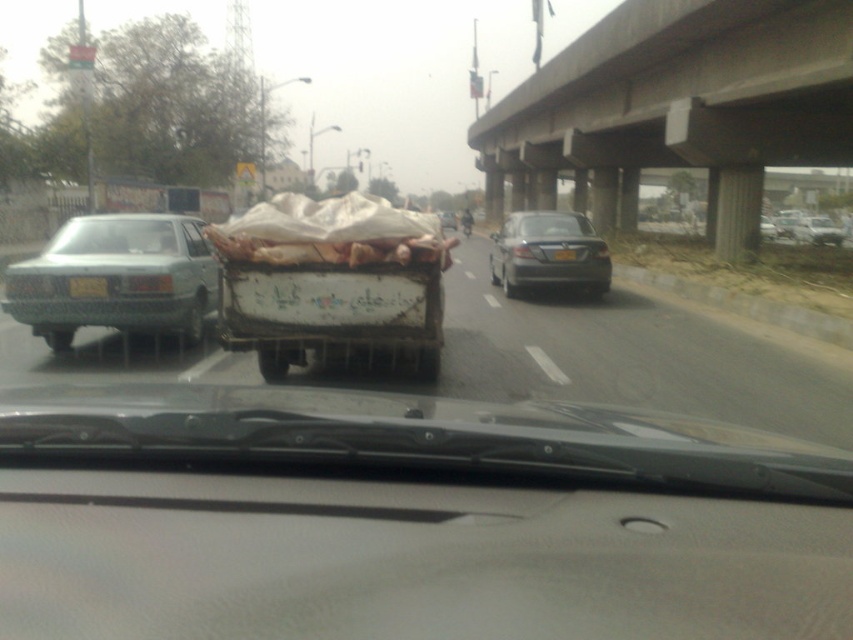
How distant is concrete at upper center from transparent glass windshield at left?

The distance of concrete at upper center from transparent glass windshield at left is 21.44 meters.

Can you confirm if concrete at upper center is positioned to the right of transparent glass windshield at left?

Indeed, concrete at upper center is positioned on the right side of transparent glass windshield at left.

Describe the element at coordinates (680, 106) in the screenshot. This screenshot has width=853, height=640. I see `concrete at upper center` at that location.

This screenshot has width=853, height=640. What are the coordinates of `concrete at upper center` in the screenshot? It's located at (680, 106).

At what (x,y) coordinates should I click in order to perform the action: click on concrete at upper center. Please return your answer as a coordinate pair (x, y). This screenshot has width=853, height=640. Looking at the image, I should click on (680, 106).

Is concrete at upper center below white painted wood cart at center?

No.

Who is more distant from viewer, (566, 99) or (390, 342)?

The point (566, 99) is more distant.

Where is `concrete at upper center`? concrete at upper center is located at coordinates (680, 106).

The width and height of the screenshot is (853, 640). Find the location of `dirty wooden cart at center`. dirty wooden cart at center is located at coordinates (625, 356).